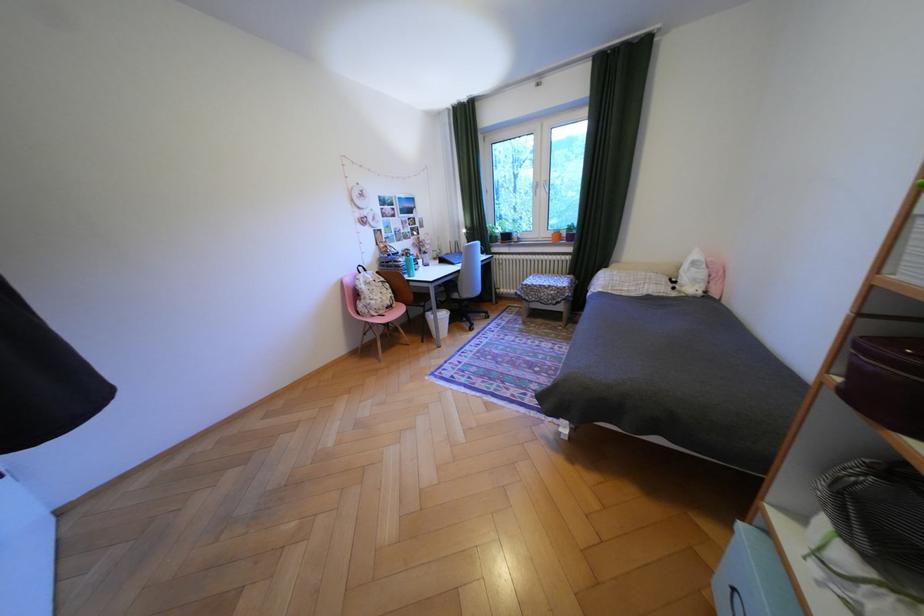
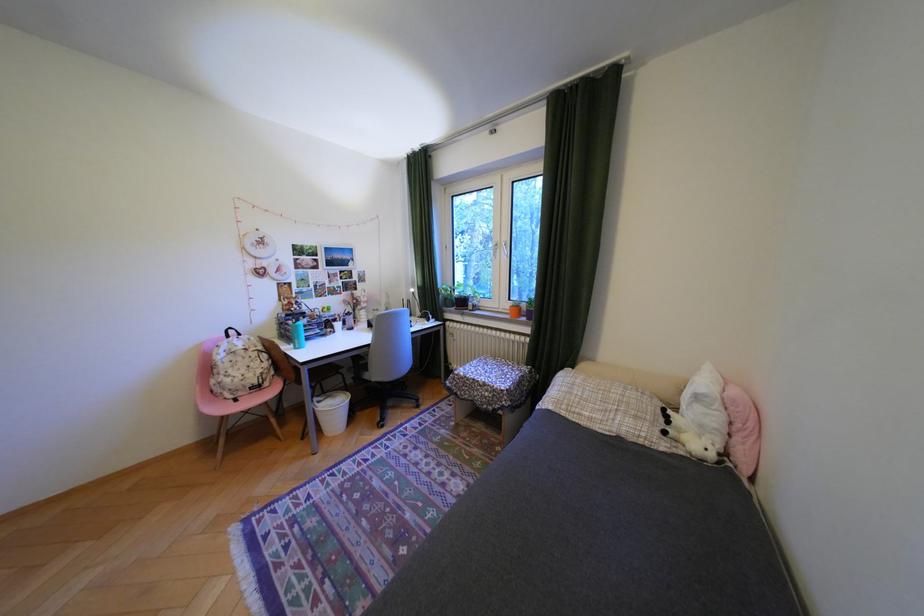
In the second image, find the point that corresponds to point (686, 288) in the first image.

(676, 432)